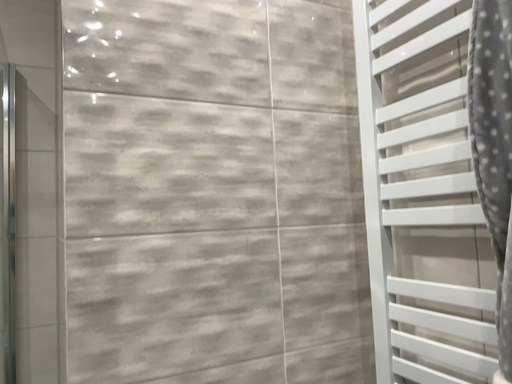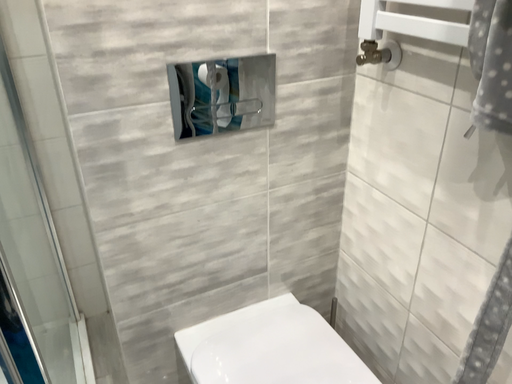
Question: Which way did the camera rotate in the video?

Choices:
 (A) rotated upward
 (B) rotated downward

Answer: (B)